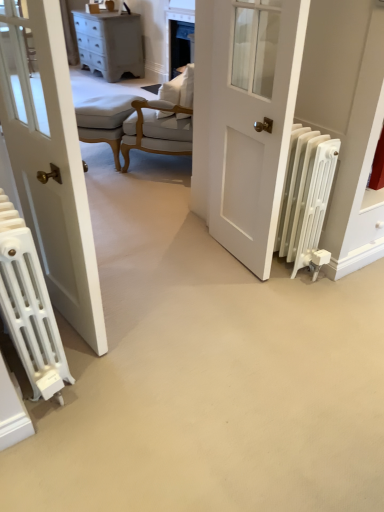
Question: Does light beige fabric stool at center have a smaller size compared to white fabric chair at center?

Choices:
 (A) no
 (B) yes

Answer: (B)

Question: Is light beige fabric stool at center outside of white fabric chair at center?

Choices:
 (A) no
 (B) yes

Answer: (B)

Question: Can you confirm if light beige fabric stool at center is thinner than white fabric chair at center?

Choices:
 (A) no
 (B) yes

Answer: (B)

Question: Is light beige fabric stool at center to the left of white fabric chair at center from the viewer's perspective?

Choices:
 (A) yes
 (B) no

Answer: (A)

Question: From a real-world perspective, is light beige fabric stool at center below white fabric chair at center?

Choices:
 (A) no
 (B) yes

Answer: (B)

Question: Considering the positions of white matte radiator at lower left, acting as the first radiator starting from the left, and white matte radiator at right, placed as the 1th radiator when sorted from right to left, in the image, is white matte radiator at lower left, acting as the first radiator starting from the left, taller or shorter than white matte radiator at right, placed as the 1th radiator when sorted from right to left,?

Choices:
 (A) tall
 (B) short

Answer: (B)

Question: Considering the positions of white matte radiator at lower left, acting as the first radiator starting from the left, and white matte radiator at right, placed as the 1th radiator when sorted from right to left, in the image, is white matte radiator at lower left, acting as the first radiator starting from the left, wider or thinner than white matte radiator at right, placed as the 1th radiator when sorted from right to left,?

Choices:
 (A) wide
 (B) thin

Answer: (A)

Question: Considering their positions, is white matte radiator at lower left, the second radiator viewed from the right, located in front of or behind white matte radiator at right, which is the second radiator in left-to-right order?

Choices:
 (A) front
 (B) behind

Answer: (A)

Question: From the image's perspective, relative to white matte radiator at right, placed as the 1th radiator when sorted from right to left, is white matte radiator at lower left, acting as the first radiator starting from the left, above or below?

Choices:
 (A) above
 (B) below

Answer: (B)

Question: Is white matte radiator at lower left, acting as the first radiator starting from the left, in front of or behind white fabric chair at center in the image?

Choices:
 (A) behind
 (B) front

Answer: (B)

Question: Would you say white matte radiator at lower left, the second radiator viewed from the right, is to the left or to the right of white fabric chair at center in the picture?

Choices:
 (A) right
 (B) left

Answer: (B)

Question: Considering the positions of white matte radiator at lower left, the second radiator viewed from the right, and white fabric chair at center in the image, is white matte radiator at lower left, the second radiator viewed from the right, taller or shorter than white fabric chair at center?

Choices:
 (A) short
 (B) tall

Answer: (A)

Question: In terms of size, does white matte radiator at lower left, the second radiator viewed from the right, appear bigger or smaller than white fabric chair at center?

Choices:
 (A) big
 (B) small

Answer: (B)

Question: Is white fabric chair at center in front of or behind white matte radiator at right, which is the second radiator in left-to-right order, in the image?

Choices:
 (A) behind
 (B) front

Answer: (A)

Question: From a real-world perspective, is white fabric chair at center physically located above or below white matte radiator at right, placed as the 1th radiator when sorted from right to left?

Choices:
 (A) below
 (B) above

Answer: (B)